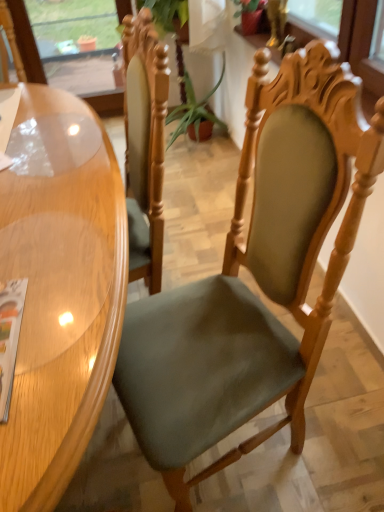
Question: Is matte paper magazine at lower left bigger than green fabric plant at center?

Choices:
 (A) yes
 (B) no

Answer: (B)

Question: Is green fabric plant at center at the back of matte paper magazine at lower left?

Choices:
 (A) yes
 (B) no

Answer: (B)

Question: Considering the relative positions of matte paper magazine at lower left and green fabric plant at center in the image provided, is matte paper magazine at lower left to the right of green fabric plant at center from the viewer's perspective?

Choices:
 (A) no
 (B) yes

Answer: (A)

Question: Does matte paper magazine at lower left have a greater height compared to green fabric plant at center?

Choices:
 (A) no
 (B) yes

Answer: (A)

Question: Can you confirm if matte paper magazine at lower left is shorter than green fabric plant at center?

Choices:
 (A) no
 (B) yes

Answer: (B)

Question: Considering the relative sizes of matte paper magazine at lower left and green fabric plant at center in the image provided, is matte paper magazine at lower left wider than green fabric plant at center?

Choices:
 (A) yes
 (B) no

Answer: (B)

Question: Does transparent glass window screen at upper left have a greater width compared to green fabric plant at center?

Choices:
 (A) no
 (B) yes

Answer: (A)

Question: Can you see transparent glass window screen at upper left touching green fabric plant at center?

Choices:
 (A) yes
 (B) no

Answer: (B)

Question: Would you consider transparent glass window screen at upper left to be distant from green fabric plant at center?

Choices:
 (A) yes
 (B) no

Answer: (A)

Question: Is the position of transparent glass window screen at upper left more distant than that of green fabric plant at center?

Choices:
 (A) no
 (B) yes

Answer: (B)

Question: Is green fabric plant at center located within transparent glass window screen at upper left?

Choices:
 (A) no
 (B) yes

Answer: (A)

Question: From a real-world perspective, is transparent glass window screen at upper left on green fabric plant at center?

Choices:
 (A) no
 (B) yes

Answer: (B)

Question: Is green fabric plant at center next to matte paper magazine at lower left and touching it?

Choices:
 (A) yes
 (B) no

Answer: (B)